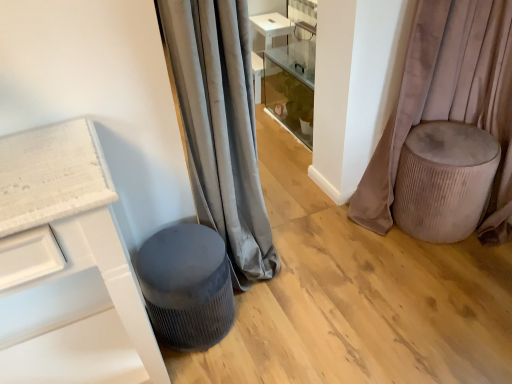
In order to click on free space in front of velvet beige stool at right, the first curtain positioned from the right in this screenshot , I will do click(423, 271).